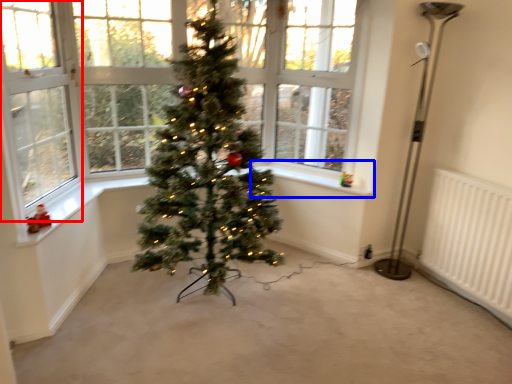
Question: Which point is further to the camera, window screen (highlighted by a red box) or window sill (highlighted by a blue box)?

Choices:
 (A) window screen
 (B) window sill

Answer: (B)